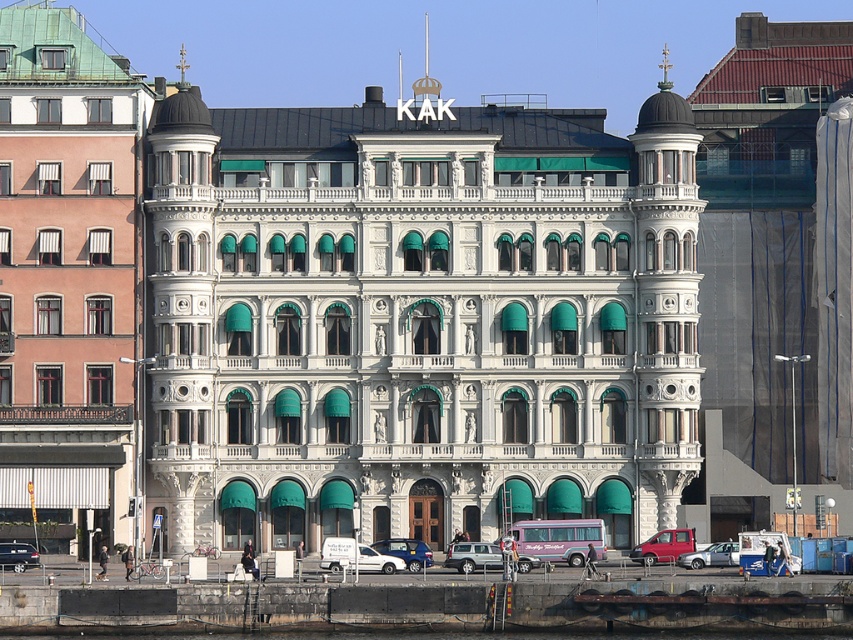
Question: Can you confirm if metallic red van at lower right is thinner than metallic silver car at lower left?

Choices:
 (A) no
 (B) yes

Answer: (A)

Question: Among these points, which one is nearest to the camera?

Choices:
 (A) (654, 544)
 (B) (734, 545)
 (C) (448, 548)
 (D) (15, 557)

Answer: (B)

Question: Can you confirm if silver metallic car at lower center is wider than metallic red van at lower right?

Choices:
 (A) no
 (B) yes

Answer: (A)

Question: Is silver metallic car at lower center positioned before silver metallic sedan at lower center?

Choices:
 (A) yes
 (B) no

Answer: (A)

Question: Which object is closer to the camera taking this photo?

Choices:
 (A) white matte van at lower center
 (B) metallic red van at lower right

Answer: (A)

Question: Estimate the real-world distances between objects in this image. Which object is closer to the metallic silver car at lower left?

Choices:
 (A) white matte van at lower center
 (B) metallic red van at lower right
 (C) silver metallic sedan at lower center

Answer: (A)